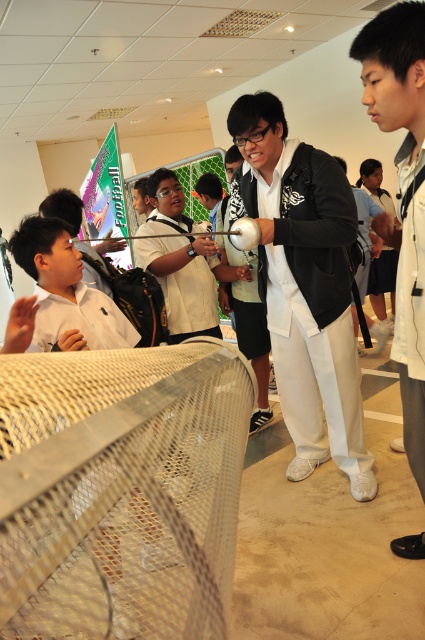
Is point (2, 506) less distant than point (278, 128)?

Yes, point (2, 506) is in front of point (278, 128).

Which of these two, metallic mesh tennis net at center or black matte jacket at center, stands shorter?

Standing shorter between the two is metallic mesh tennis net at center.

Is point (161, 524) closer to viewer compared to point (280, 202)?

Yes, it is in front of point (280, 202).

At what (x,y) coordinates should I click in order to perform the action: click on metallic mesh tennis net at center. Please return your answer as a coordinate pair (x, y). Looking at the image, I should click on (121, 493).